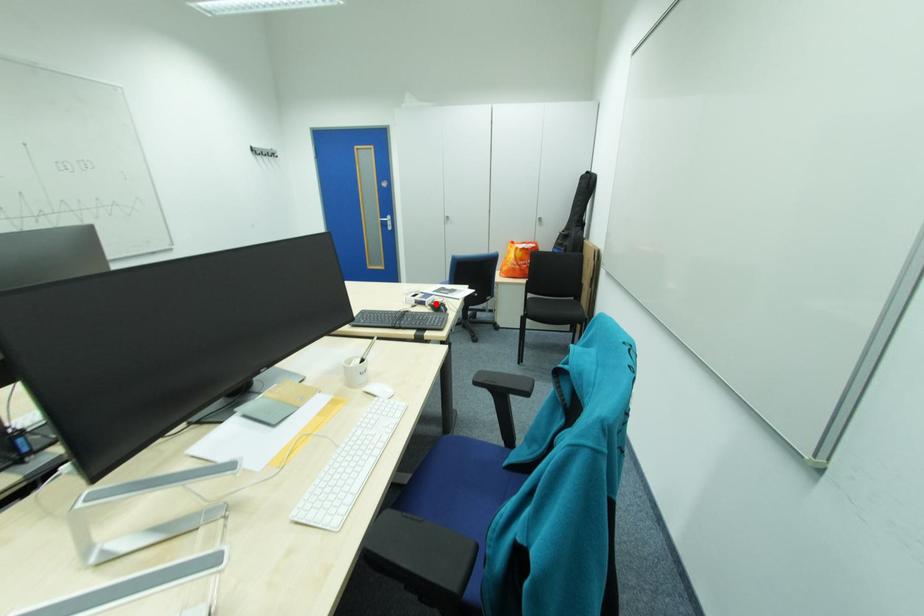
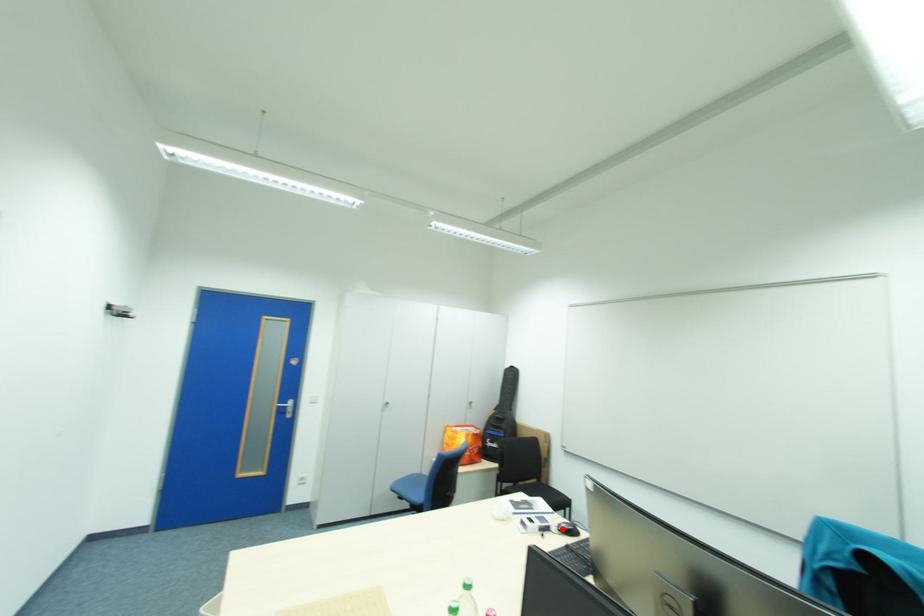
I am providing you with two images of the same scene from different viewpoints. A red point is marked on the first image and another point is marked on the second image. Does the point marked in image1 correspond to the same location as the one in image2?

Yes